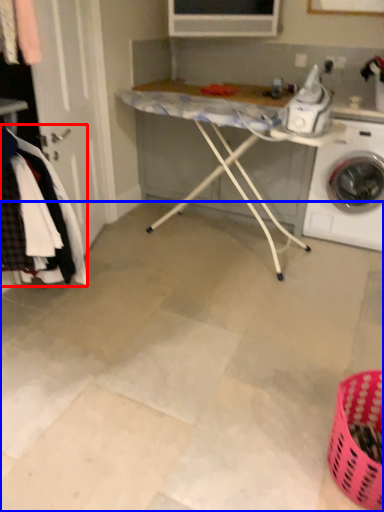
Question: Which object is further to the camera taking this photo, clothing (highlighted by a red box) or concrete (highlighted by a blue box)?

Choices:
 (A) clothing
 (B) concrete

Answer: (A)